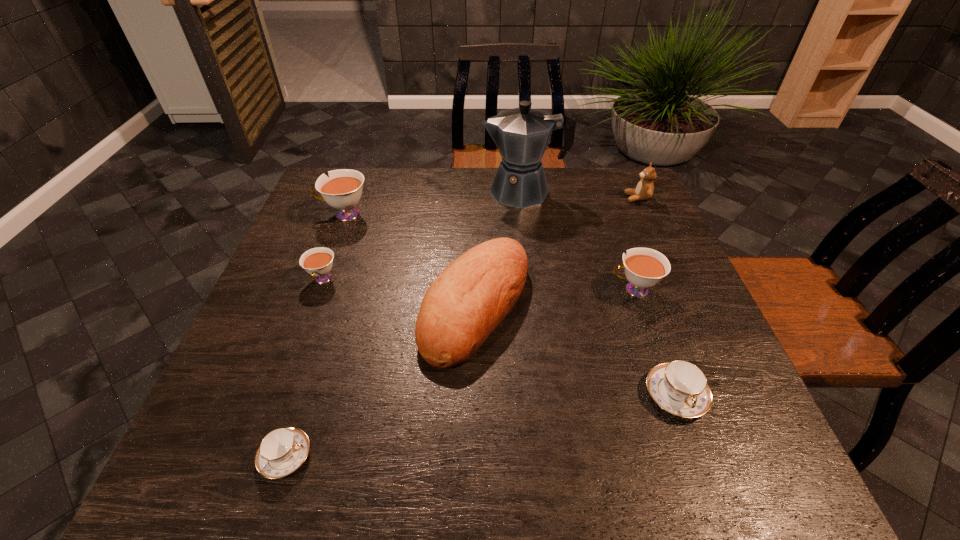
You are a GUI agent. You are given a task and a screenshot of the screen. Output one action in this format:
    pyautogui.click(x=<x>, y=<y>)
    Task: Click on the teacup that is the third closest to the smaller blue teacup
    
    Given the screenshot: What is the action you would take?
    pyautogui.click(x=680, y=387)

Identify the location of teacup that is the closest to the farthest white teacup. This screenshot has height=540, width=960. (318, 262).

The width and height of the screenshot is (960, 540). In order to click on white teacup that is the second closest to the smallest white teacup in this screenshot , I will do `click(644, 267)`.

At what (x,y) coordinates should I click in order to perform the action: click on the second closest white teacup to the light bread. Please return your answer as a coordinate pair (x, y). Looking at the image, I should click on (318, 262).

Identify the location of free space that satisfies the following two spatial constraints: 1. on the front-facing side of the teddy bear; 2. on the side of the smallest white teacup with the handle. (674, 280).

Where is `free location that satisfies the following two spatial constraints: 1. on the side of the biggest white teacup with the handle; 2. on the right side of the light bread`? free location that satisfies the following two spatial constraints: 1. on the side of the biggest white teacup with the handle; 2. on the right side of the light bread is located at coordinates (311, 306).

The height and width of the screenshot is (540, 960). What are the coordinates of `vacant space that satisfies the following two spatial constraints: 1. at the spout of the coffeepot; 2. on the side of the smallest white teacup with the handle` in the screenshot? It's located at (536, 280).

The height and width of the screenshot is (540, 960). Identify the location of vacant space that satisfies the following two spatial constraints: 1. at the spout of the tallest object; 2. on the front side of the bread. (539, 306).